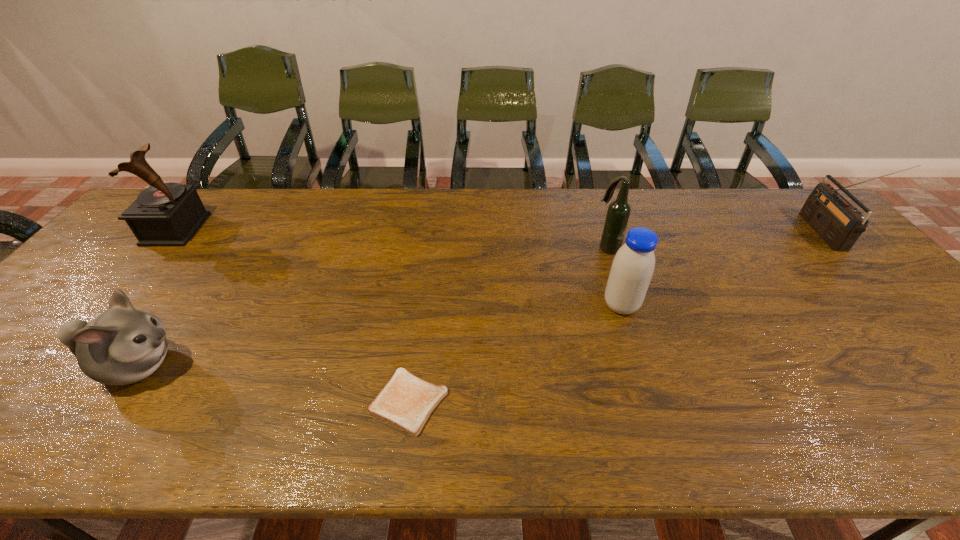
This screenshot has width=960, height=540. I want to click on free space between the radio receiver and the shortest object, so click(616, 318).

Identify the location of free space between the rightmost object and the beer bottle. The image size is (960, 540). (715, 241).

Locate an element on the screen. This screenshot has height=540, width=960. free space between the rightmost object and the second shortest object is located at coordinates (480, 300).

Identify the location of empty space that is in between the beer bottle and the phonograph_record. The width and height of the screenshot is (960, 540). (392, 239).

The height and width of the screenshot is (540, 960). Find the location of `vacant region between the shortest object and the soya milk`. vacant region between the shortest object and the soya milk is located at coordinates (515, 354).

The image size is (960, 540). Identify the location of object that stands as the fifth closest to the shortest object. (839, 224).

Locate an element on the screen. object that is the second closest to the hamster is located at coordinates (406, 402).

At what (x,y) coordinates should I click in order to perform the action: click on vacant area that satisfies the following two spatial constraints: 1. on the front side of the beer bottle; 2. on the face of the hamster. Please return your answer as a coordinate pair (x, y). Looking at the image, I should click on (645, 366).

Identify the location of blank area in the image that satisfies the following two spatial constraints: 1. at the horn opening of the third nearest object; 2. on the left side of the phonograph_record. This screenshot has width=960, height=540. (111, 306).

This screenshot has height=540, width=960. Find the location of `vacant position in the image that satisfies the following two spatial constraints: 1. at the horn opening of the shortest object; 2. on the left side of the phonograph_record`. vacant position in the image that satisfies the following two spatial constraints: 1. at the horn opening of the shortest object; 2. on the left side of the phonograph_record is located at coordinates (32, 401).